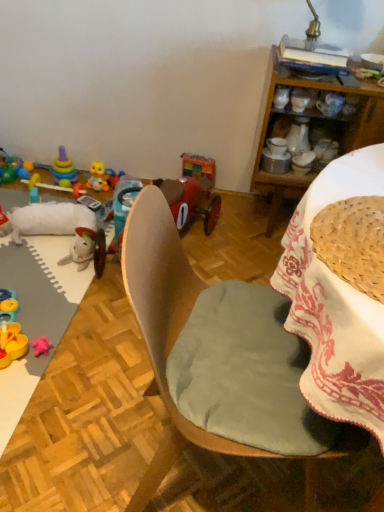
Question: Considering the relative sizes of wooden chair at center and woven straw basket at upper right in the image provided, is wooden chair at center wider than woven straw basket at upper right?

Choices:
 (A) no
 (B) yes

Answer: (B)

Question: Can you confirm if wooden chair at center is positioned to the right of woven straw basket at upper right?

Choices:
 (A) yes
 (B) no

Answer: (B)

Question: From the image's perspective, does wooden chair at center appear higher than woven straw basket at upper right?

Choices:
 (A) no
 (B) yes

Answer: (A)

Question: From a real-world perspective, is wooden chair at center over woven straw basket at upper right?

Choices:
 (A) yes
 (B) no

Answer: (B)

Question: Is woven straw basket at upper right surrounded by wooden chair at center?

Choices:
 (A) yes
 (B) no

Answer: (A)

Question: From a real-world perspective, is translucent plastic toy at left, which is counted as the 1th toy, starting from the left, above or below rubber duck at lower left, the 3th toy from the left?

Choices:
 (A) above
 (B) below

Answer: (B)

Question: In the image, is translucent plastic toy at left, which is counted as the 1th toy, starting from the left, on the left side or the right side of rubber duck at lower left, the 3th toy from the left?

Choices:
 (A) right
 (B) left

Answer: (B)

Question: From their relative heights in the image, would you say translucent plastic toy at left, which is counted as the 1th toy, starting from the left, is taller or shorter than rubber duck at lower left, the 3th toy from the left?

Choices:
 (A) short
 (B) tall

Answer: (A)

Question: Looking at their shapes, would you say translucent plastic toy at left, the 5th toy viewed from the right, is wider or thinner than rubber duck at lower left, arranged as the third toy when viewed from the right?

Choices:
 (A) thin
 (B) wide

Answer: (A)

Question: Considering the positions of woven straw basket at upper right and white ceramic coffee cup at upper right, arranged as the 1th coffee cup when viewed from the left, in the image, is woven straw basket at upper right bigger or smaller than white ceramic coffee cup at upper right, arranged as the 1th coffee cup when viewed from the left,?

Choices:
 (A) big
 (B) small

Answer: (A)

Question: Is woven straw basket at upper right inside or outside of white ceramic coffee cup at upper right, which is the 2th coffee cup in right-to-left order?

Choices:
 (A) outside
 (B) inside

Answer: (A)

Question: Looking at their shapes, would you say woven straw basket at upper right is wider or thinner than white ceramic coffee cup at upper right, which is the 2th coffee cup in right-to-left order?

Choices:
 (A) thin
 (B) wide

Answer: (B)

Question: Does point (337, 230) appear closer or farther from the camera than point (299, 98)?

Choices:
 (A) farther
 (B) closer

Answer: (B)

Question: Considering the positions of wooden cabinet at upper right and wooden chair at center in the image, is wooden cabinet at upper right bigger or smaller than wooden chair at center?

Choices:
 (A) small
 (B) big

Answer: (B)

Question: Do you think wooden cabinet at upper right is within wooden chair at center, or outside of it?

Choices:
 (A) inside
 (B) outside

Answer: (B)